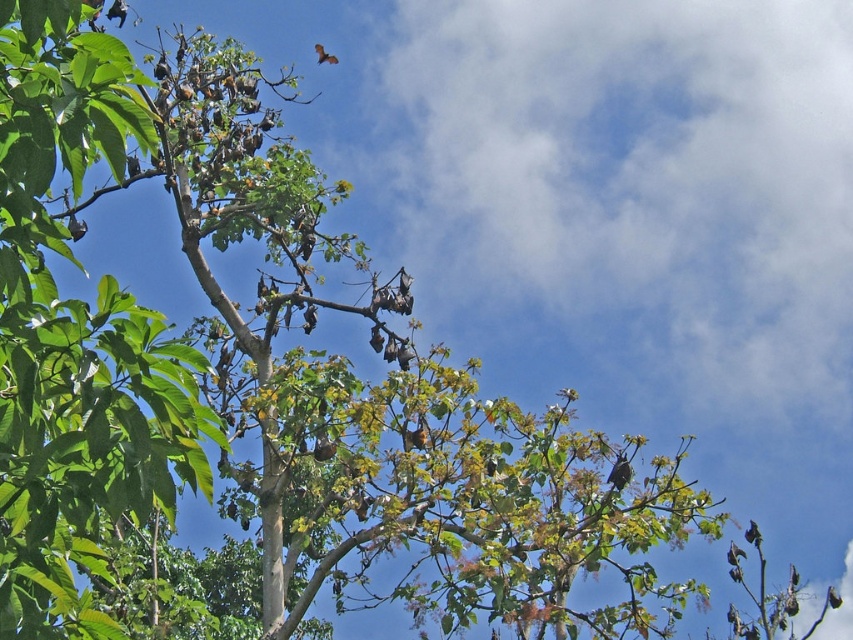
Question: Which object is the closest to the brown fuzzy bat at upper center?

Choices:
 (A) brown furry bat at lower right
 (B) shiny black bird at center
 (C) dark brown feathers at upper right

Answer: (B)

Question: Is dark brown feathers at upper right thinner than brown matte bat at upper center?

Choices:
 (A) yes
 (B) no

Answer: (B)

Question: Which object is positioned farthest from the brown furry bat at lower right?

Choices:
 (A) dark brown feathers at upper right
 (B) brown furry bat at upper left

Answer: (B)

Question: Can you confirm if dark brown feathers at upper right is positioned to the right of brown matte bat at upper center?

Choices:
 (A) no
 (B) yes

Answer: (B)

Question: Does brown fuzzy bat at upper center appear on the left side of brown furry bat at upper left?

Choices:
 (A) yes
 (B) no

Answer: (B)

Question: Which of the following is the closest to the observer?

Choices:
 (A) dark brown feathers at upper right
 (B) brown furry bat at upper left
 (C) brown fuzzy bat at upper center
 (D) shiny black bird at center

Answer: (D)